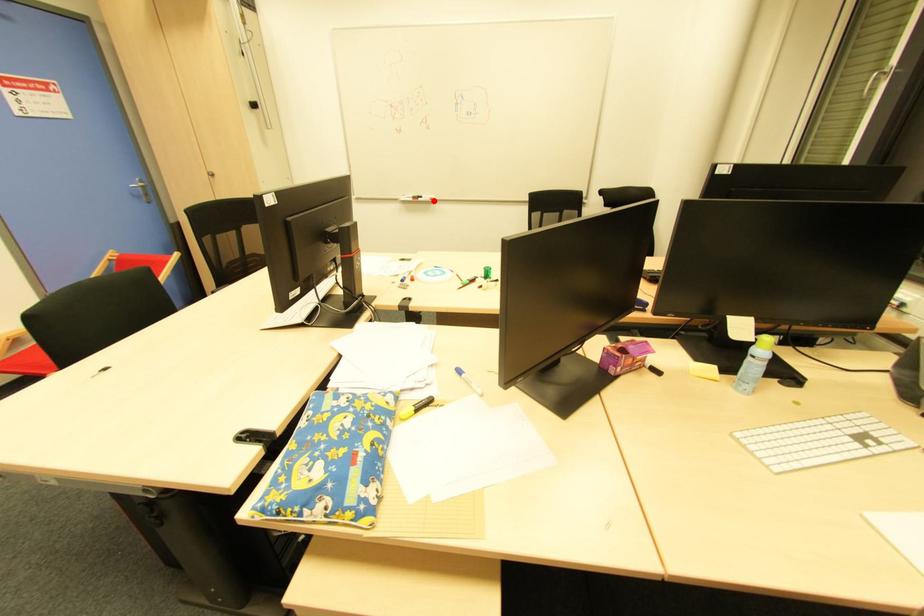
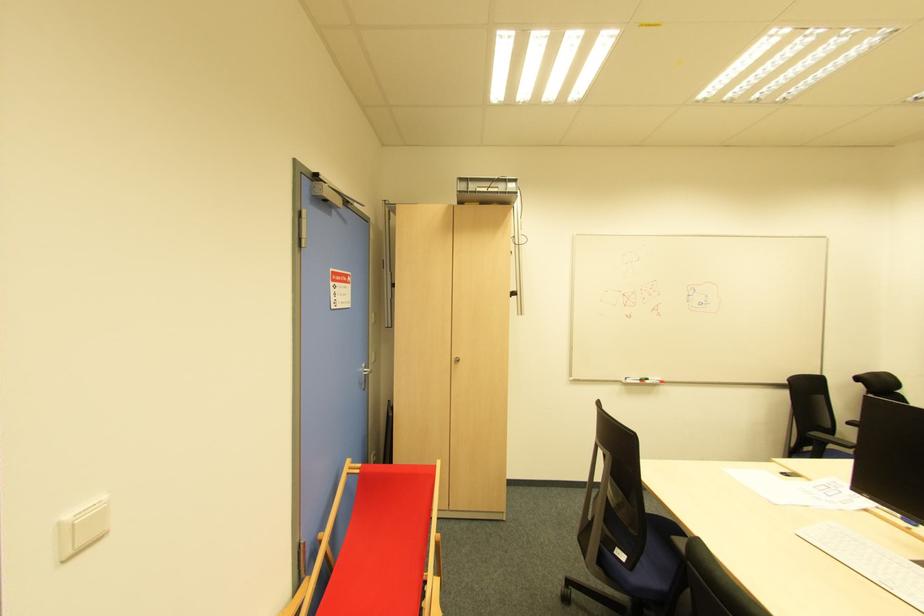
Locate, in the second image, the point that corresponds to the highlighted location in the first image.

(662, 383)